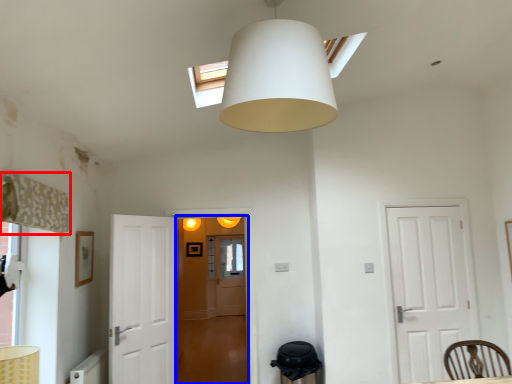
Question: Among these objects, which one is nearest to the camera, curtain (highlighted by a red box) or glass door (highlighted by a blue box)?

Choices:
 (A) curtain
 (B) glass door

Answer: (A)